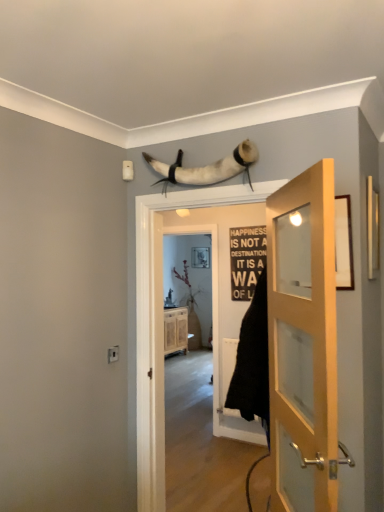
Question: Is white leather horns at upper center inside wooden cabinet at center?

Choices:
 (A) no
 (B) yes

Answer: (A)

Question: Considering the relative sizes of wooden cabinet at center and white leather horns at upper center in the image provided, is wooden cabinet at center smaller than white leather horns at upper center?

Choices:
 (A) no
 (B) yes

Answer: (A)

Question: Could you tell me if wooden cabinet at center is turned towards white leather horns at upper center?

Choices:
 (A) yes
 (B) no

Answer: (B)

Question: Is wooden cabinet at center bigger than white leather horns at upper center?

Choices:
 (A) yes
 (B) no

Answer: (A)

Question: Is wooden cabinet at center not inside white leather horns at upper center?

Choices:
 (A) yes
 (B) no

Answer: (A)

Question: Looking at their shapes, would you say wooden cabinet at center is wider or thinner than wooden door at right, which is counted as the 2th door, starting from the back?

Choices:
 (A) wide
 (B) thin

Answer: (A)

Question: Considering their positions, is wooden cabinet at center located in front of or behind wooden door at right, which is counted as the 2th door, starting from the back?

Choices:
 (A) front
 (B) behind

Answer: (B)

Question: Is wooden cabinet at center spatially inside wooden door at right, marked as the first door in a front-to-back arrangement, or outside of it?

Choices:
 (A) outside
 (B) inside

Answer: (A)

Question: Is point (175, 309) closer or farther from the camera than point (279, 401)?

Choices:
 (A) farther
 (B) closer

Answer: (A)

Question: Considering their positions, is matte black picture frame at upper center located in front of or behind white leather horns at upper center?

Choices:
 (A) front
 (B) behind

Answer: (B)

Question: From the image's perspective, relative to white leather horns at upper center, is matte black picture frame at upper center above or below?

Choices:
 (A) below
 (B) above

Answer: (A)

Question: Does point (205, 250) appear closer or farther from the camera than point (153, 160)?

Choices:
 (A) farther
 (B) closer

Answer: (A)

Question: Choose the correct answer: Is matte black picture frame at upper center inside white leather horns at upper center or outside it?

Choices:
 (A) outside
 (B) inside

Answer: (A)

Question: Is wooden door at right, marked as the first door in a front-to-back arrangement, wider or thinner than white leather horns at upper center?

Choices:
 (A) thin
 (B) wide

Answer: (A)

Question: Considering the positions of wooden door at right, which is counted as the 2th door, starting from the back, and white leather horns at upper center in the image, is wooden door at right, which is counted as the 2th door, starting from the back, bigger or smaller than white leather horns at upper center?

Choices:
 (A) big
 (B) small

Answer: (A)